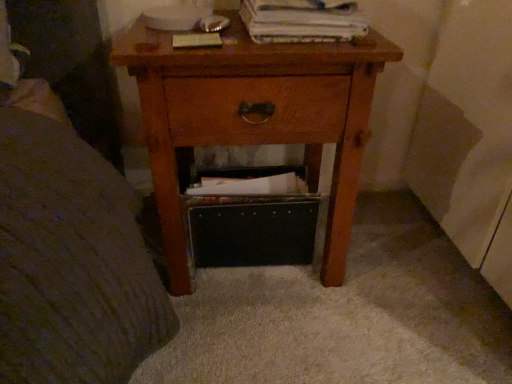
Question: Is white paper at upper center, arranged as the first paperback book when viewed from the right, positioned beyond the bounds of wooden nightstand at center?

Choices:
 (A) yes
 (B) no

Answer: (A)

Question: Can you confirm if white paper at upper center, arranged as the first paperback book when viewed from the right, is shorter than wooden nightstand at center?

Choices:
 (A) no
 (B) yes

Answer: (B)

Question: Is white paper at upper center, arranged as the first paperback book when viewed from the right, facing away from wooden nightstand at center?

Choices:
 (A) yes
 (B) no

Answer: (B)

Question: Does white paper at upper center, arranged as the first paperback book when viewed from the right, have a smaller size compared to wooden nightstand at center?

Choices:
 (A) no
 (B) yes

Answer: (B)

Question: Does white paper at upper center, arranged as the first paperback book when viewed from the right, come behind wooden nightstand at center?

Choices:
 (A) yes
 (B) no

Answer: (A)

Question: From a real-world perspective, is white paper at upper center, arranged as the first paperback book when viewed from the right, above or below matte brown paperback book at upper center, the second paperback book from the right?

Choices:
 (A) below
 (B) above

Answer: (B)

Question: From their relative heights in the image, would you say white paper at upper center, arranged as the first paperback book when viewed from the right, is taller or shorter than matte brown paperback book at upper center, which is the 1th paperback book from left to right?

Choices:
 (A) tall
 (B) short

Answer: (A)

Question: Relative to matte brown paperback book at upper center, which is the 1th paperback book from left to right, is white paper at upper center, arranged as the first paperback book when viewed from the right, in front or behind?

Choices:
 (A) behind
 (B) front

Answer: (B)

Question: Is white paper at upper center, the second paperback book viewed from the left, wider or thinner than matte brown paperback book at upper center, the second paperback book from the right?

Choices:
 (A) wide
 (B) thin

Answer: (A)

Question: From the image's perspective, relative to matte brown paperback book at upper center, the second paperback book from the right, is wooden nightstand at center above or below?

Choices:
 (A) above
 (B) below

Answer: (B)

Question: Is wooden nightstand at center situated inside matte brown paperback book at upper center, the second paperback book from the right, or outside?

Choices:
 (A) outside
 (B) inside

Answer: (A)

Question: Considering the positions of point (355, 177) and point (193, 43), is point (355, 177) closer or farther from the camera than point (193, 43)?

Choices:
 (A) farther
 (B) closer

Answer: (A)

Question: From a real-world perspective, relative to matte brown paperback book at upper center, the second paperback book from the right, is wooden nightstand at center vertically above or below?

Choices:
 (A) above
 (B) below

Answer: (B)

Question: From a real-world perspective, is matte brown paperback book at upper center, the second paperback book from the right, physically located above or below wooden nightstand at center?

Choices:
 (A) below
 (B) above

Answer: (B)

Question: Would you say matte brown paperback book at upper center, the second paperback book from the right, is to the left or to the right of wooden nightstand at center in the picture?

Choices:
 (A) left
 (B) right

Answer: (A)